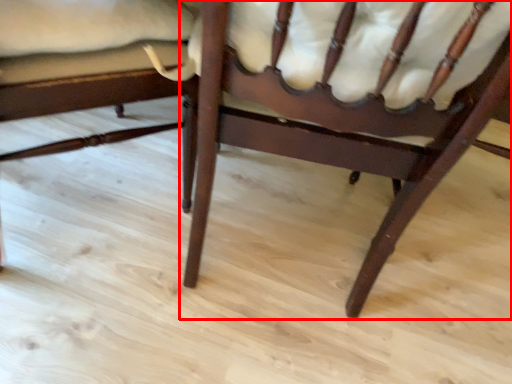
Question: Observing the image, what is the correct spatial positioning of chair (annotated by the red box) in reference to chair?

Choices:
 (A) left
 (B) right

Answer: (B)